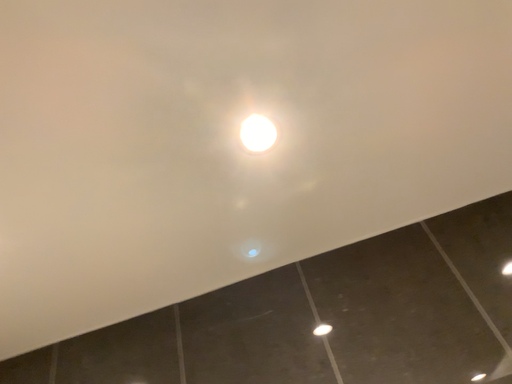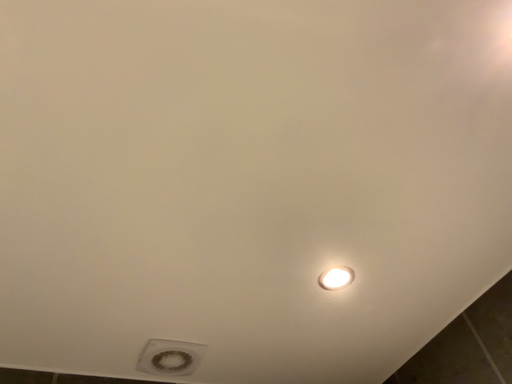
Question: Which way did the camera rotate in the video?

Choices:
 (A) rotated left
 (B) rotated right

Answer: (A)